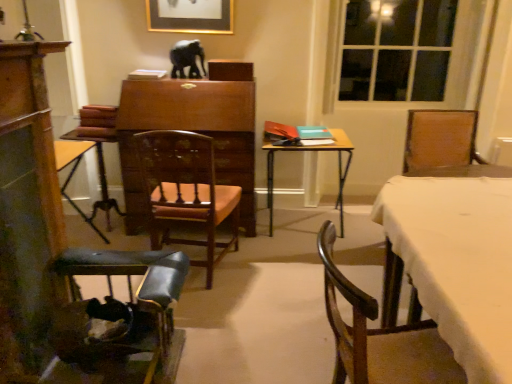
The height and width of the screenshot is (384, 512). I want to click on free space in front of wooden table at center, so click(x=297, y=261).